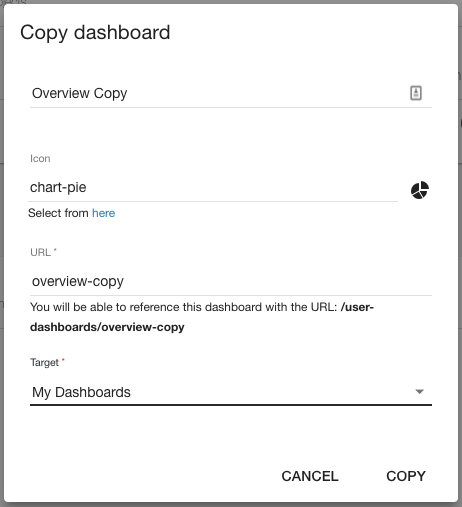
Identify the location of dark gray panel outline. (248, 2), (2, 331), (459, 347), (212, 501).